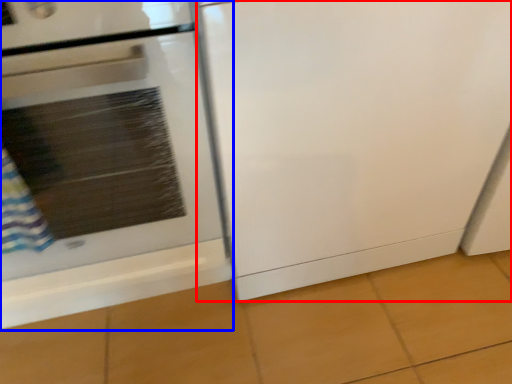
Question: Which point is further to the camera, screen door (highlighted by a red box) or home appliance (highlighted by a blue box)?

Choices:
 (A) screen door
 (B) home appliance

Answer: (A)